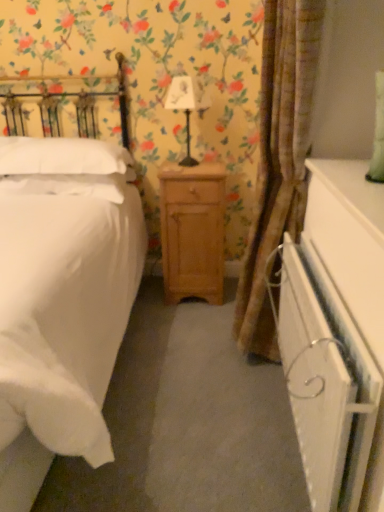
I want to click on free location above light brown wood nightstand at center (from a real-world perspective), so click(192, 168).